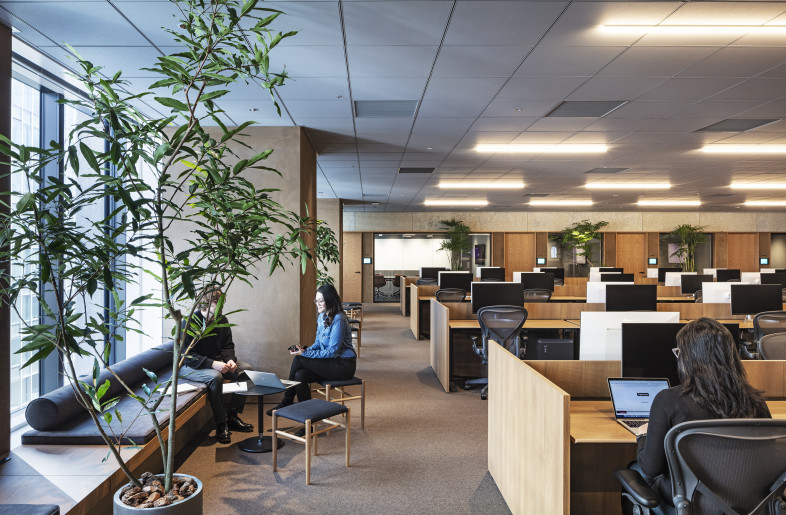
Find the location of a particular element. stool is located at coordinates (x=340, y=383), (x=310, y=430), (x=351, y=325), (x=353, y=310), (x=354, y=302).